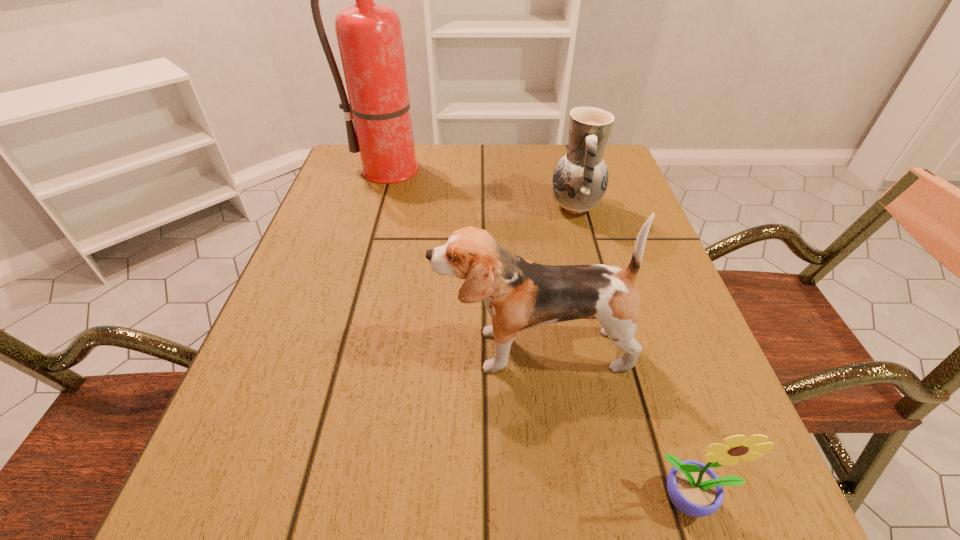
You are a GUI agent. You are given a task and a screenshot of the screen. Output one action in this format:
    pyautogui.click(x=<x>, y=<y>)
    Task: Click on the free point at the far right corner
    
    Given the screenshot: What is the action you would take?
    pyautogui.click(x=615, y=156)

The height and width of the screenshot is (540, 960). What are the coordinates of `free space between the nearest object and the third farthest object` in the screenshot? It's located at (612, 424).

At what (x,y) coordinates should I click in order to perform the action: click on unoccupied position between the third tallest object and the leftmost object. Please return your answer as a coordinate pair (x, y). This screenshot has height=540, width=960. Looking at the image, I should click on click(487, 188).

Locate which object is the second closest to the puppy. Please provide its 2D coordinates. Your answer should be formatted as a tuple, i.e. [(x, y)], where the tuple contains the x and y coordinates of a point satisfying the conditions above.

[(580, 179)]

Choose which object is the second nearest neighbor to the farthest object. Please provide its 2D coordinates. Your answer should be formatted as a tuple, i.e. [(x, y)], where the tuple contains the x and y coordinates of a point satisfying the conditions above.

[(519, 294)]